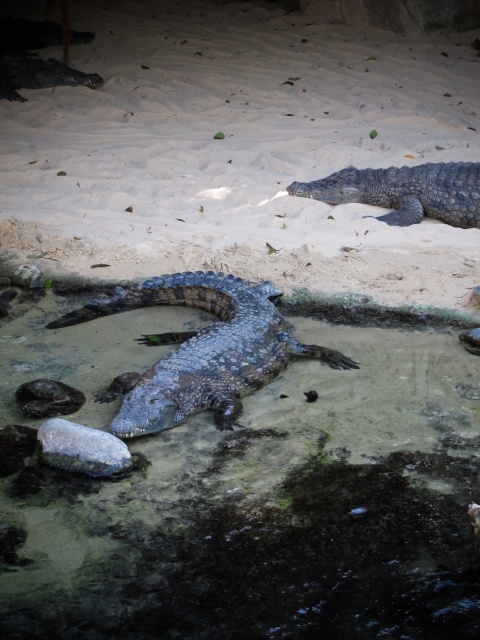
Question: Can you confirm if sandy textured mud at center is positioned to the right of shiny gray crocodile at center?

Choices:
 (A) no
 (B) yes

Answer: (B)

Question: Does shiny gray crocodile at center lie in front of gray scaly crocodile at upper right?

Choices:
 (A) yes
 (B) no

Answer: (A)

Question: Is sandy textured mud at center thinner than gray scaly crocodile at upper right?

Choices:
 (A) yes
 (B) no

Answer: (B)

Question: Which of the following is the farthest from the observer?

Choices:
 (A) shiny gray crocodile at center
 (B) sandy textured mud at center
 (C) gray scaly crocodile at upper right

Answer: (C)

Question: Which object appears farthest from the camera in this image?

Choices:
 (A) shiny gray crocodile at center
 (B) sandy textured mud at center

Answer: (A)

Question: Which object appears farthest from the camera in this image?

Choices:
 (A) sandy textured mud at center
 (B) shiny gray crocodile at center
 (C) gray scaly crocodile at upper right

Answer: (C)